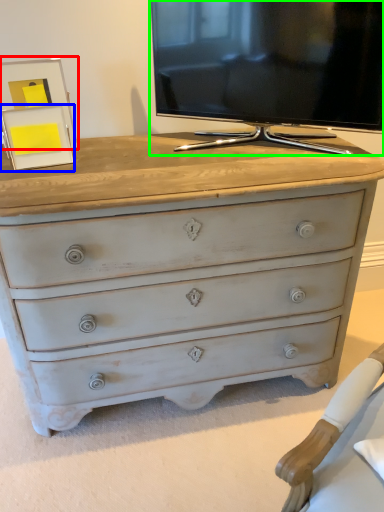
Question: Which object is the farthest from picture frame (highlighted by a red box)? Choose among these: picture frame (highlighted by a blue box) or television (highlighted by a green box).

Choices:
 (A) picture frame
 (B) television

Answer: (B)